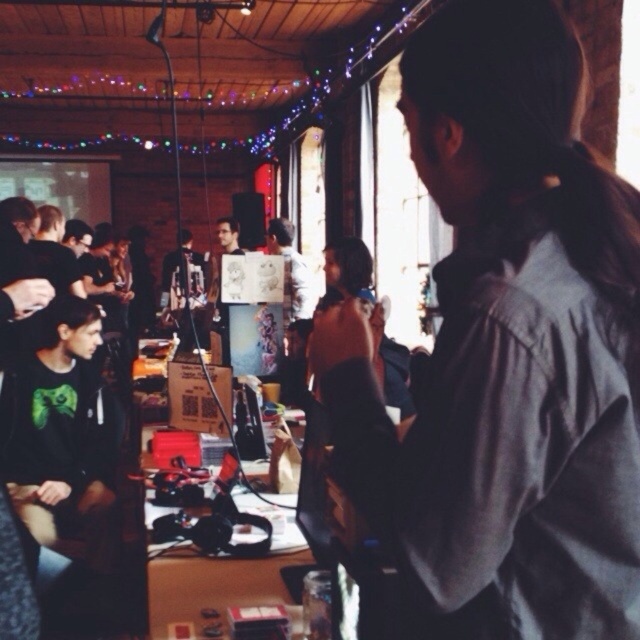
Question: Does gray shirt at upper right have a larger size compared to matte black shirt at left?

Choices:
 (A) no
 (B) yes

Answer: (A)

Question: Which point is closer to the camera taking this photo?

Choices:
 (A) (92, 476)
 (B) (52, 269)
 (C) (502, 10)

Answer: (C)

Question: Which point appears farthest from the camera in this image?

Choices:
 (A) (570, 296)
 (B) (60, 230)

Answer: (B)

Question: Among these points, which one is nearest to the camera?

Choices:
 (A) (56, 291)
 (B) (534, 86)

Answer: (B)

Question: From the image, what is the correct spatial relationship of gray shirt at upper right in relation to black matte shirt at lower left?

Choices:
 (A) left
 (B) right

Answer: (B)

Question: Can you confirm if black matte shirt at lower left is thinner than matte black shirt at left?

Choices:
 (A) no
 (B) yes

Answer: (A)